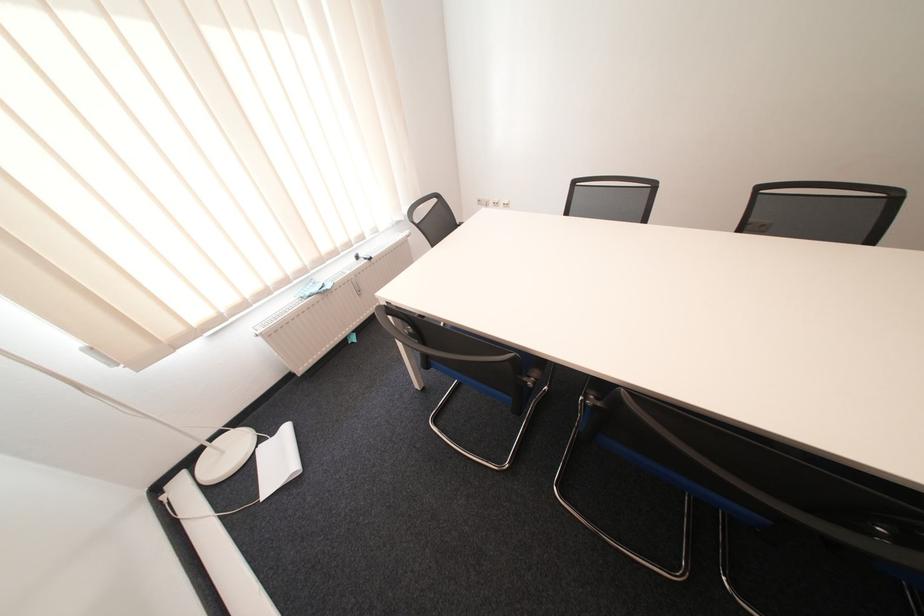
Which object does [361,257] point to?

It corresponds to the black marker in the image.